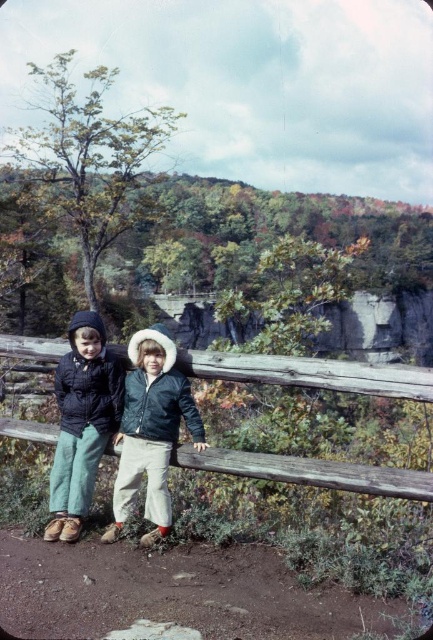
Who is taller, velvet blue jacket at center or matte black jacket at left?

matte black jacket at left

The image size is (433, 640). What do you see at coordinates (151, 429) in the screenshot?
I see `velvet blue jacket at center` at bounding box center [151, 429].

Is point (125, 472) in front of point (102, 392)?

Yes.

Locate an element on the screen. velvet blue jacket at center is located at coordinates (151, 429).

Which of these two, wooden fence at center or velvet blue jacket at center, stands taller?

Standing taller between the two is velvet blue jacket at center.

Can you confirm if wooden fence at center is wider than velvet blue jacket at center?

Yes, wooden fence at center is wider than velvet blue jacket at center.

Is point (432, 385) positioned before point (135, 422)?

Yes, point (432, 385) is closer to viewer.

Where is `wooden fence at center`? wooden fence at center is located at coordinates (313, 372).

Does wooden fence at center appear on the right side of matte black jacket at left?

Yes, wooden fence at center is to the right of matte black jacket at left.

From the picture: Which is more to the left, wooden fence at center or matte black jacket at left?

matte black jacket at left is more to the left.

You are a GUI agent. You are given a task and a screenshot of the screen. Output one action in this format:
    pyautogui.click(x=<x>, y=<y>)
    Task: Click on the wooden fence at center
    This screenshot has width=433, height=640.
    Given the screenshot: What is the action you would take?
    313,372

Identify the location of wooden fence at center. This screenshot has height=640, width=433. (313, 372).